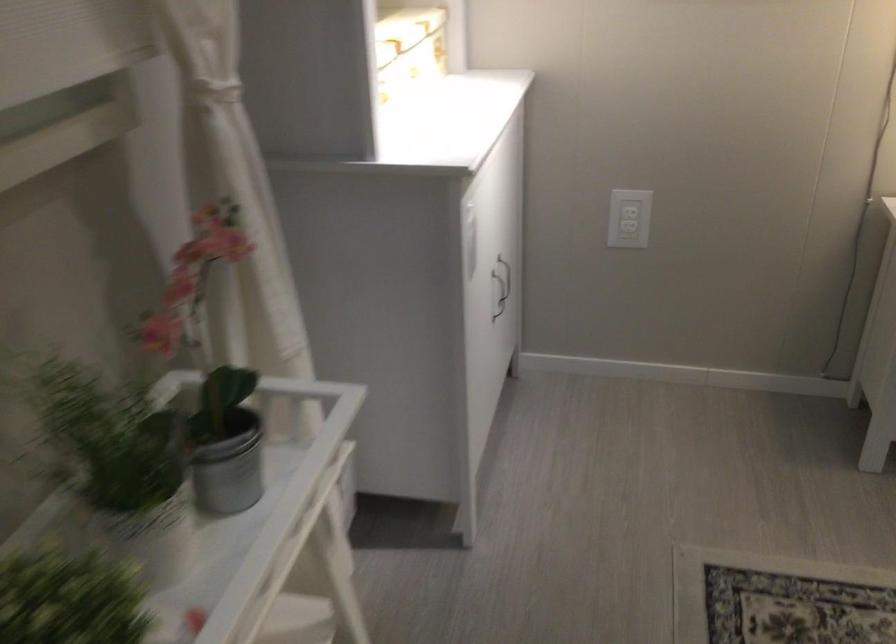
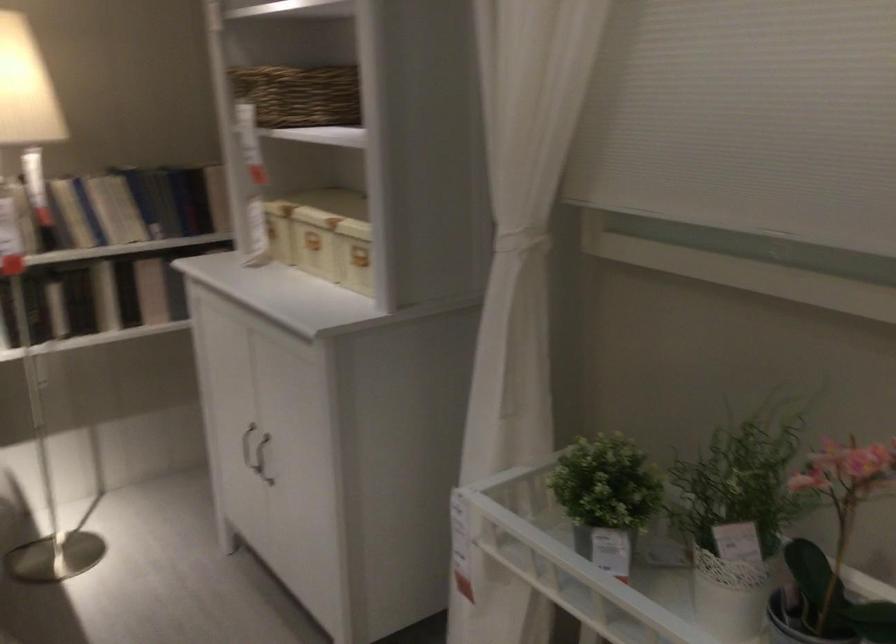
Find the pixel in the second image that matches point 124,471 in the first image.

(735, 518)